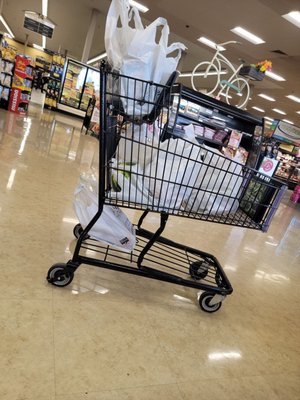
What are the coordinates of `ceiling` in the screenshot? It's located at (226, 26).